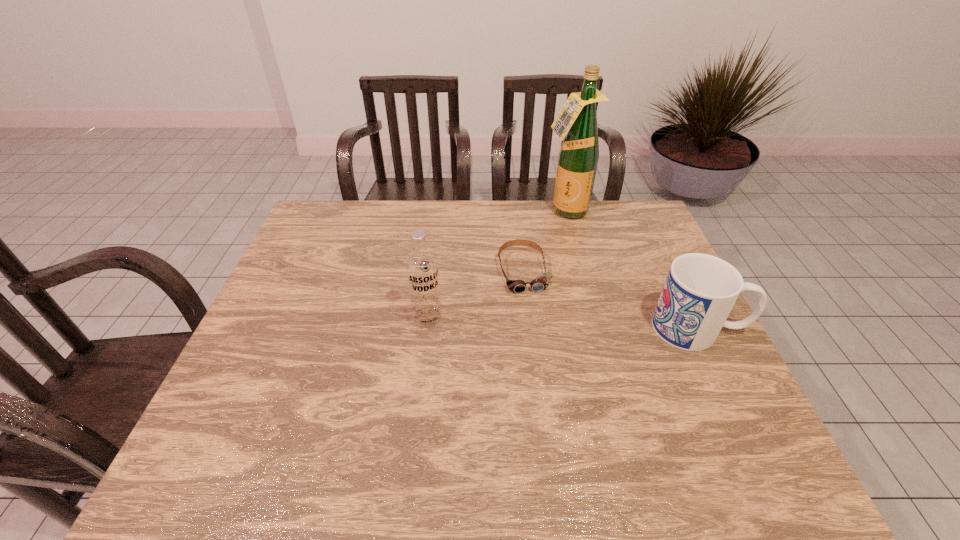
You are a GUI agent. You are given a task and a screenshot of the screen. Output one action in this format:
    pyautogui.click(x=<x>, y=<y>)
    Task: Click on the vacant space that is in between the goggles and the third shortest object
    The height and width of the screenshot is (540, 960).
    Given the screenshot: What is the action you would take?
    pyautogui.click(x=475, y=295)

Identify the location of free space between the vodka and the second shortest object. (563, 323).

Identify the location of vacant area that lies between the goggles and the rightmost object. (611, 300).

Find the location of `the closest object to the second farthest object`. the closest object to the second farthest object is located at coordinates (421, 265).

You are a GUI agent. You are given a task and a screenshot of the screen. Output one action in this format:
    pyautogui.click(x=<x>, y=<y>)
    Task: Click on the object that stands as the third closest to the leftmost object
    
    Given the screenshot: What is the action you would take?
    pyautogui.click(x=700, y=291)

Identify the location of free region that satisfies the following two spatial constraints: 1. on the front label of the third tallest object; 2. on the left side of the vodka. This screenshot has height=540, width=960. pyautogui.click(x=426, y=328).

The width and height of the screenshot is (960, 540). Find the location of `vacant region that satisfies the following two spatial constraints: 1. on the front label of the second tallest object; 2. on the right side of the rightmost object`. vacant region that satisfies the following two spatial constraints: 1. on the front label of the second tallest object; 2. on the right side of the rightmost object is located at coordinates (426, 328).